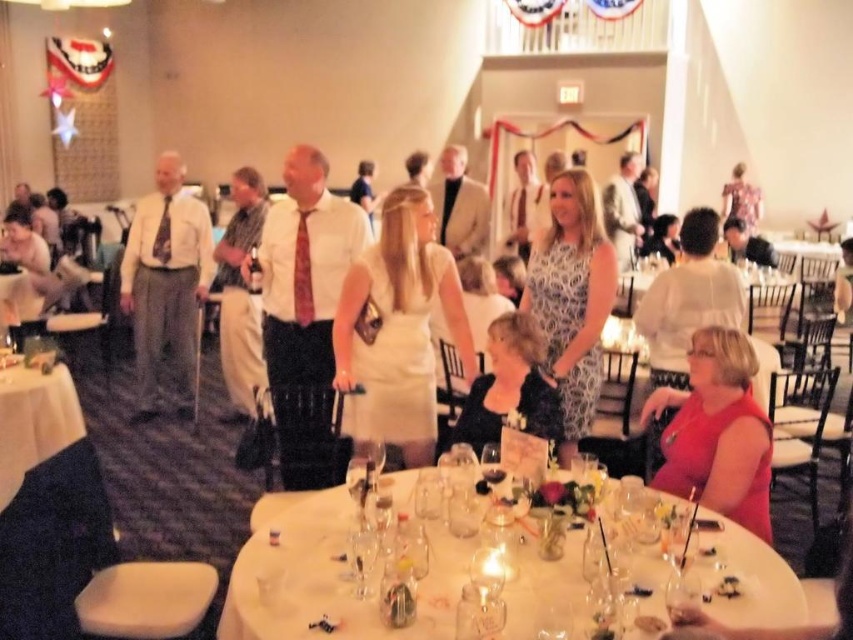
You are a photographer positioned at the entrance of the venue. You need to capture a photo that includes both the black satin dress at center and the patterned silk tie at center. What is the minimum distance you must move forward to ensure both are in frame?

The black satin dress at center is 9.92 feet from the patterned silk tie at center. To include both in the frame, you must move forward at least 9.92 feet.

You are standing at the entrance of the banquet hall and see the white glossy table at lower center and the matte red dress at lower right. From your position, which object is positioned to the left?

The white glossy table at lower center is positioned to the left of the matte red dress at lower right.

You are a photographer at the event and need to position yourself to capture both the white satin dress at center and the matte white shirt at center in the same frame. From the perspective of someone facing the table, which side should you stand on to ensure both are visible without moving the camera?

You should stand to the left side of the table. Since the white satin dress at center is to the right of the matte white shirt at center, positioning yourself to the left allows both subjects to be captured in the frame without needing to move the camera.